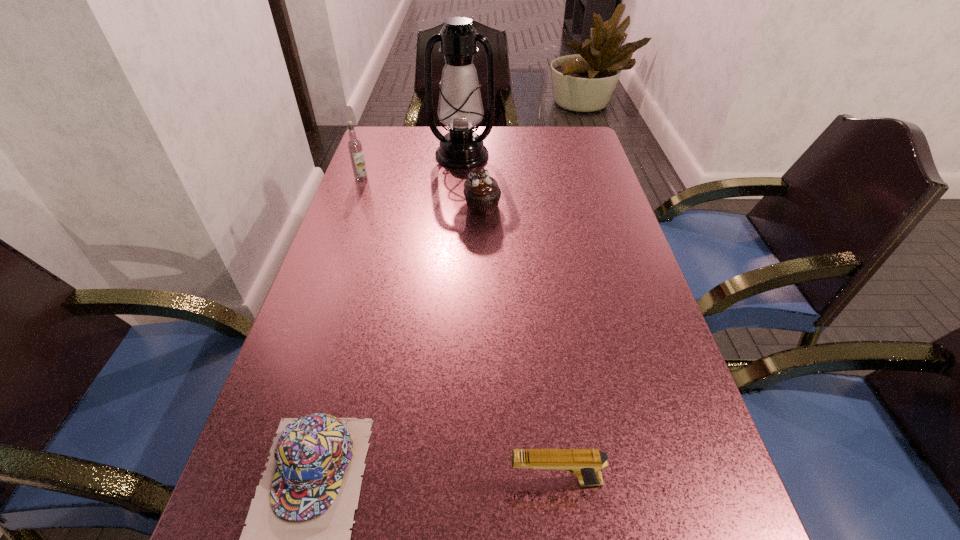
You are a GUI agent. You are given a task and a screenshot of the screen. Output one action in this format:
    pyautogui.click(x=<x>, y=<y>)
    Task: Click on the tallest object
    This screenshot has height=540, width=960.
    Given the screenshot: What is the action you would take?
    pyautogui.click(x=460, y=108)

Locate an element on the screen. The width and height of the screenshot is (960, 540). oil lamp is located at coordinates (460, 108).

You are a GUI agent. You are given a task and a screenshot of the screen. Output one action in this format:
    pyautogui.click(x=<x>, y=<y>)
    Task: Click on the vodka
    The width and height of the screenshot is (960, 540).
    Given the screenshot: What is the action you would take?
    pyautogui.click(x=354, y=145)

Where is `the second tallest object`? the second tallest object is located at coordinates (354, 145).

Where is `the third farthest object`? The height and width of the screenshot is (540, 960). the third farthest object is located at coordinates (482, 193).

I want to click on pistol, so click(586, 464).

Find the location of `free region located on the back of the tallest object`. free region located on the back of the tallest object is located at coordinates (463, 134).

Find the location of a particular element. This screenshot has width=960, height=540. vacant position located 0.210m on the label of the second tallest object is located at coordinates (345, 226).

Where is `blank space located on the left of the cupcake`? This screenshot has width=960, height=540. blank space located on the left of the cupcake is located at coordinates (358, 207).

The width and height of the screenshot is (960, 540). I want to click on vacant space located 0.380m at the barrel of the pistol, so [x=265, y=481].